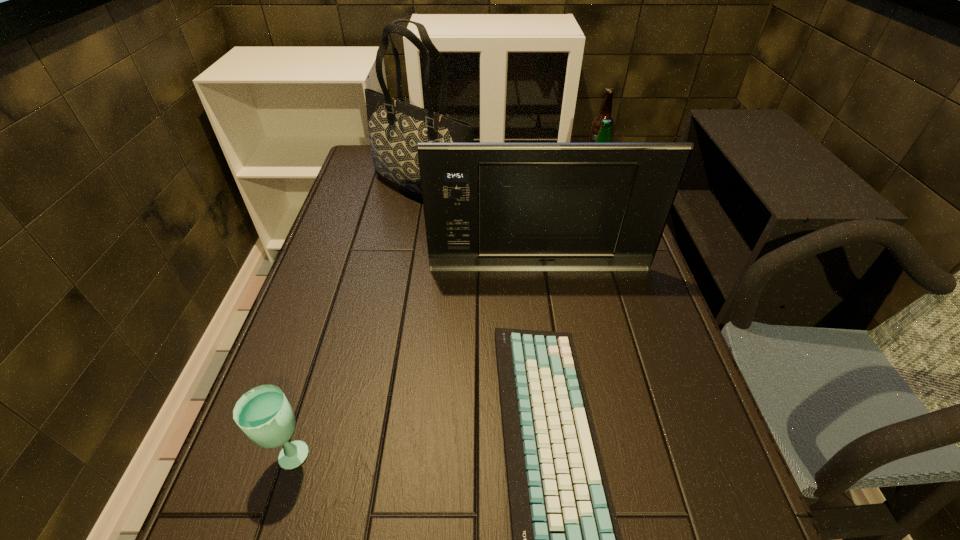
This screenshot has height=540, width=960. Find the location of `the tallest object`. the tallest object is located at coordinates (395, 127).

You are a GUI agent. You are given a task and a screenshot of the screen. Output one action in this format:
    pyautogui.click(x=<x>, y=<y>)
    Task: Click on the fourth farthest object
    The height and width of the screenshot is (540, 960).
    Given the screenshot: What is the action you would take?
    pyautogui.click(x=487, y=206)

Locate an element on the screen. The height and width of the screenshot is (540, 960). microwave oven is located at coordinates coord(487,206).

Locate an element on the screen. The width and height of the screenshot is (960, 540). the nearer beer bottle is located at coordinates (604, 136).

At what (x,y) coordinates should I click in order to perform the action: click on the farther beer bottle. Please return your answer as a coordinate pair (x, y). Looking at the image, I should click on tap(605, 111).

Image resolution: width=960 pixels, height=540 pixels. What are the coordinates of `the second shortest object` in the screenshot? It's located at (264, 414).

I want to click on blank area located on the right of the tote bag, so click(x=582, y=189).

This screenshot has height=540, width=960. Find the location of `free space located 0.280m on the front panel of the third nearest object`. free space located 0.280m on the front panel of the third nearest object is located at coordinates (553, 364).

Identify the location of free space located on the label of the nearer beer bottle. (540, 215).

The image size is (960, 540). In order to click on vacant region located 0.130m on the label of the nearer beer bottle in this screenshot , I will do pyautogui.click(x=530, y=215).